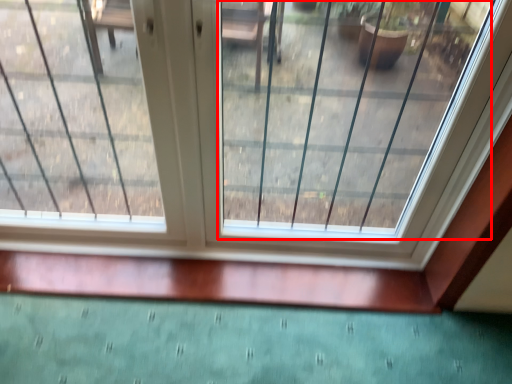
Question: From the image's perspective, where is glass window (annotated by the red box) located relative to window?

Choices:
 (A) above
 (B) below

Answer: (A)